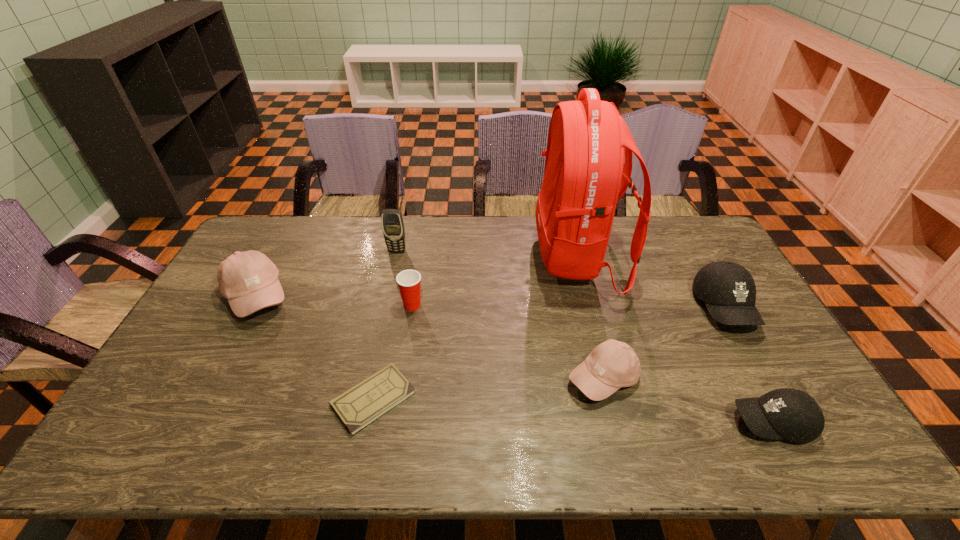
Identify the location of red backpack. The width and height of the screenshot is (960, 540). (585, 175).

The width and height of the screenshot is (960, 540). In order to click on backpack in this screenshot , I will do `click(585, 175)`.

Where is `cellular telephone`? cellular telephone is located at coordinates (392, 222).

The width and height of the screenshot is (960, 540). Identify the location of the bigger pink baseball cap. (249, 280).

At what (x,y) coordinates should I click in order to perform the action: click on the leftmost object. Please return your answer as a coordinate pair (x, y). The width and height of the screenshot is (960, 540). Looking at the image, I should click on (249, 280).

I want to click on the bigger black baseball cap, so click(728, 289).

The image size is (960, 540). What are the coordinates of `red Dixie cup` in the screenshot? It's located at (408, 281).

Where is `the nearer pink baseball cap`? the nearer pink baseball cap is located at coordinates (611, 365).

Where is `the second baseball cap from left to right`? Image resolution: width=960 pixels, height=540 pixels. the second baseball cap from left to right is located at coordinates (611, 365).

You are a GUI agent. You are given a task and a screenshot of the screen. Output one action in this format:
    pyautogui.click(x=<x>, y=<y>)
    Task: Click on the nearer black baseball cap
    The height and width of the screenshot is (540, 960).
    Given the screenshot: What is the action you would take?
    pyautogui.click(x=791, y=414)